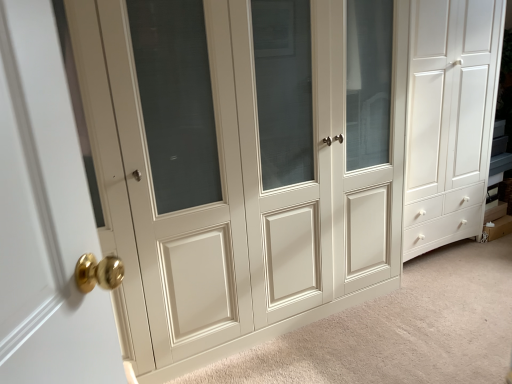
What do you see at coordinates (450, 119) in the screenshot? I see `white matte cabinet door at right` at bounding box center [450, 119].

Locate an element on the screen. This screenshot has height=384, width=512. white matte cabinet door at right is located at coordinates (450, 119).

Where is `white matte cabinet door at right`? The height and width of the screenshot is (384, 512). white matte cabinet door at right is located at coordinates (450, 119).